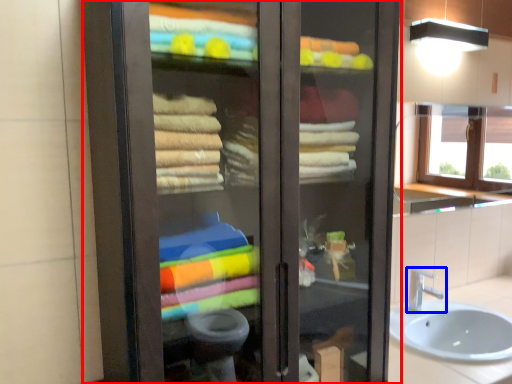
Question: Which of the following is the farthest to the observer, bathroom cabinet (highlighted by a red box) or tap (highlighted by a blue box)?

Choices:
 (A) bathroom cabinet
 (B) tap

Answer: (B)